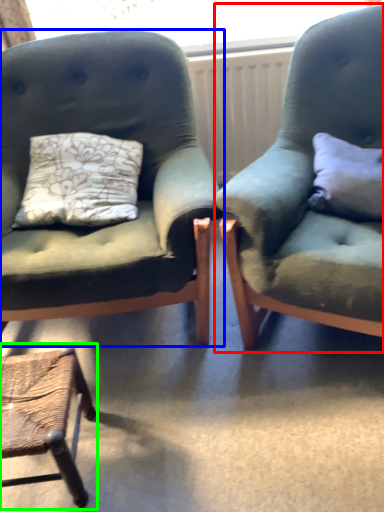
Question: Which object is positioned closest to chair (highlighted by a red box)? Select from chair (highlighted by a blue box) and chair (highlighted by a green box).

Choices:
 (A) chair
 (B) chair

Answer: (A)